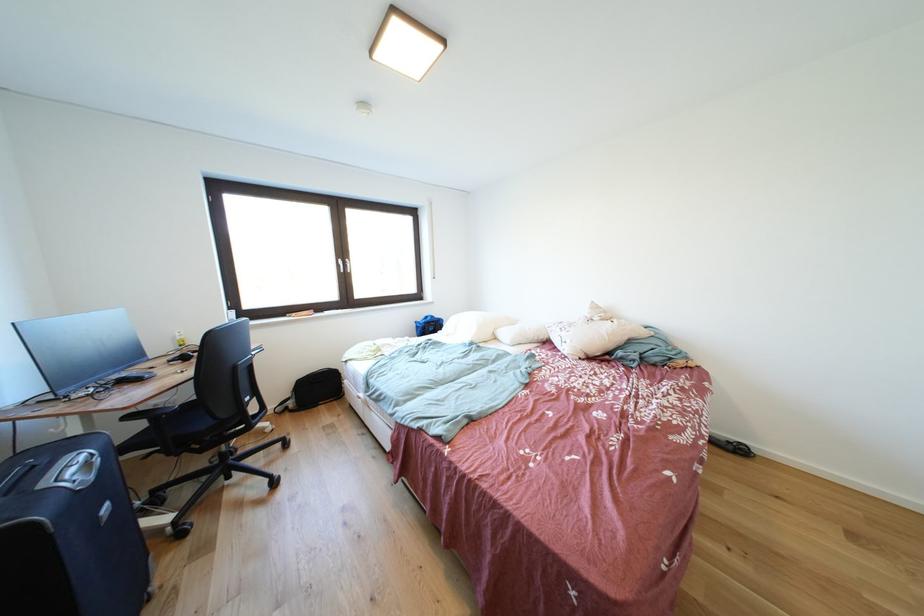
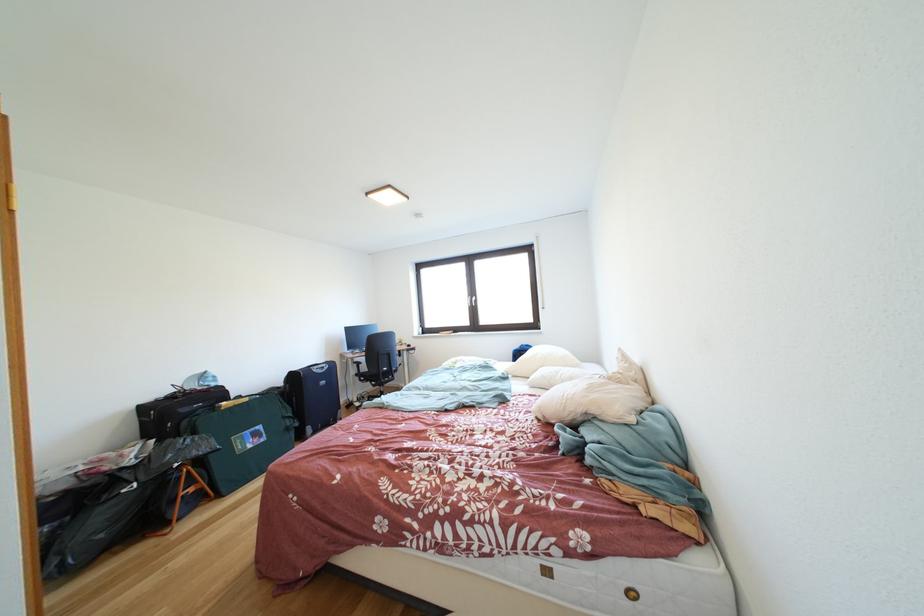
Locate, in the second image, the point that corresponds to (590,361) in the first image.

(549, 421)